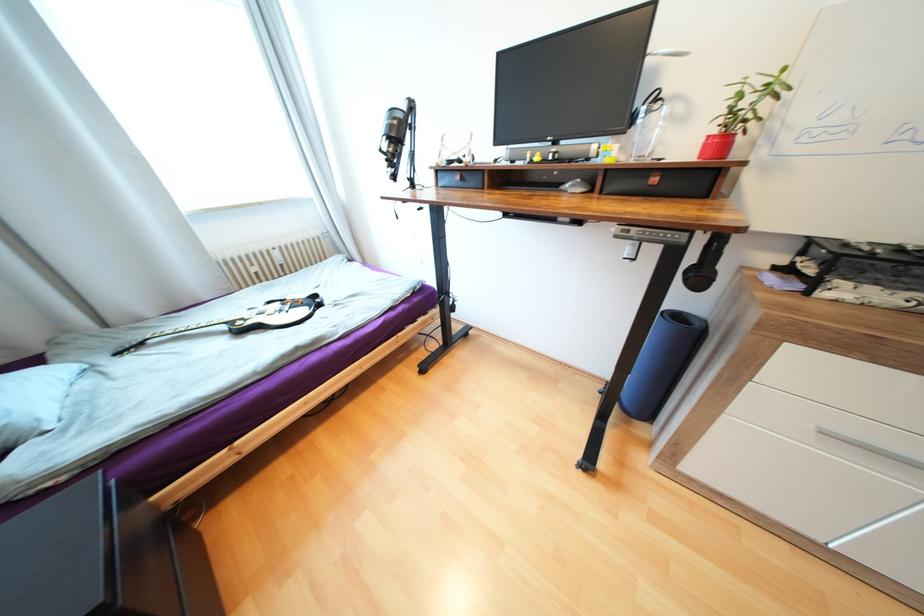
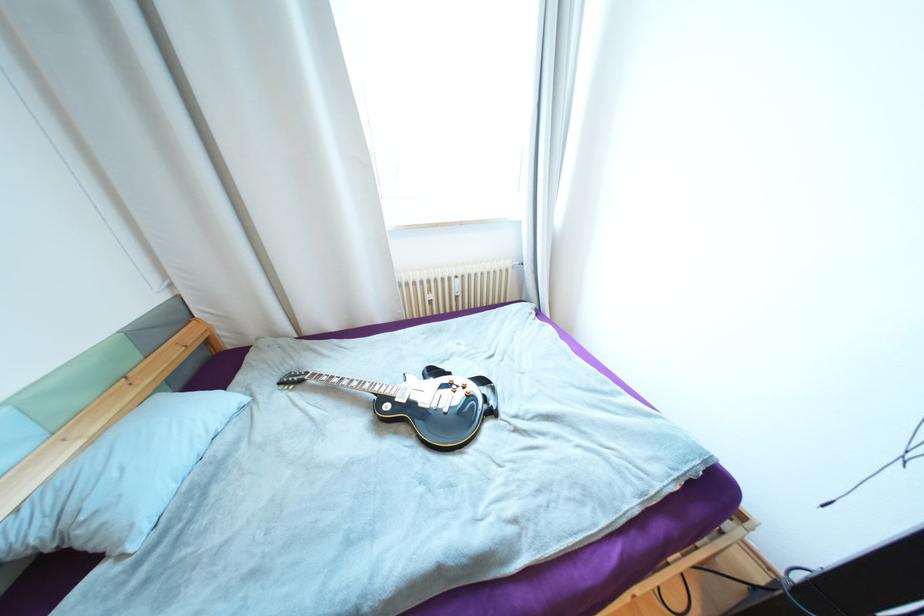
Where in the second image is the point corresponding to pixel 325 305 from the first image?

(497, 413)